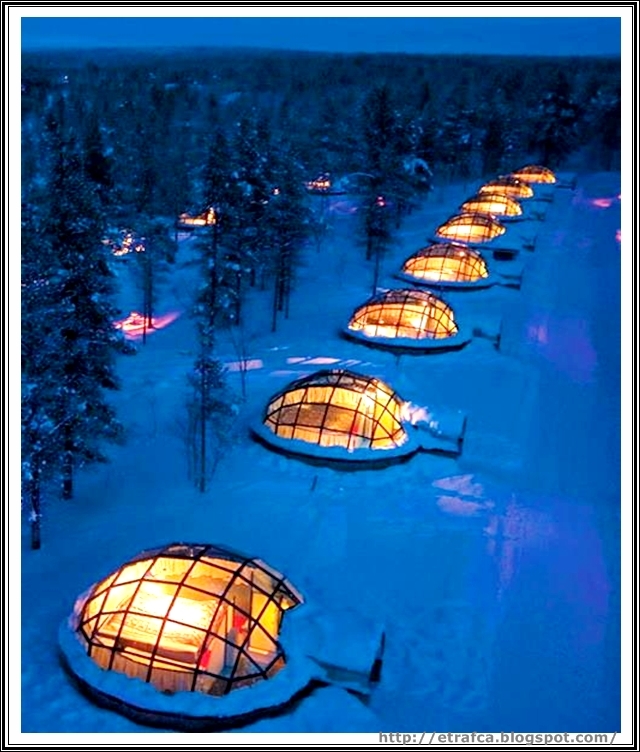
I want to click on glass, so click(329, 413), click(172, 590), click(409, 313).